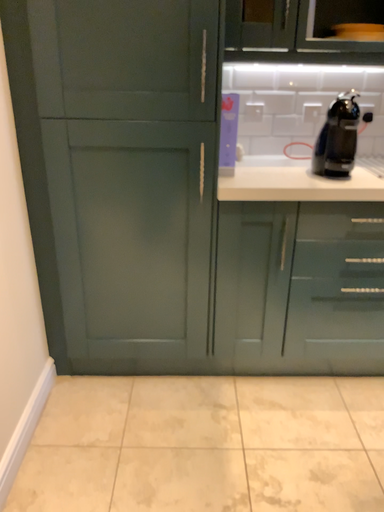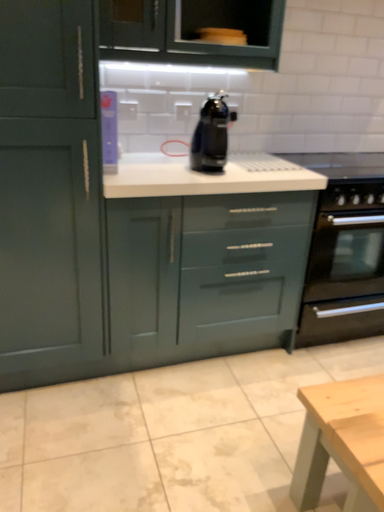
Question: Which way did the camera rotate in the video?

Choices:
 (A) rotated left
 (B) rotated right

Answer: (B)